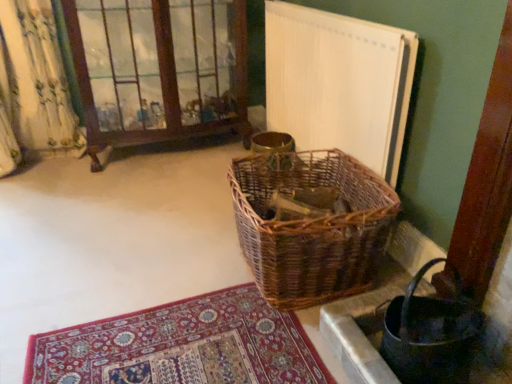
Question: Considering their positions, is woven brown picnic basket at center located in front of or behind woven brown basket at lower right?

Choices:
 (A) front
 (B) behind

Answer: (B)

Question: Is woven brown picnic basket at center inside the boundaries of woven brown basket at lower right, or outside?

Choices:
 (A) outside
 (B) inside

Answer: (A)

Question: Which is farther from the woven brown basket at lower right?

Choices:
 (A) woven brown picnic basket at center
 (B) brown wooden window frame at upper left
 (C) white textured radiator at upper right

Answer: (B)

Question: Which is farther from the woven brown basket at lower right?

Choices:
 (A) white textured radiator at upper right
 (B) woven brown picnic basket at center
 (C) brown wooden window frame at upper left

Answer: (C)